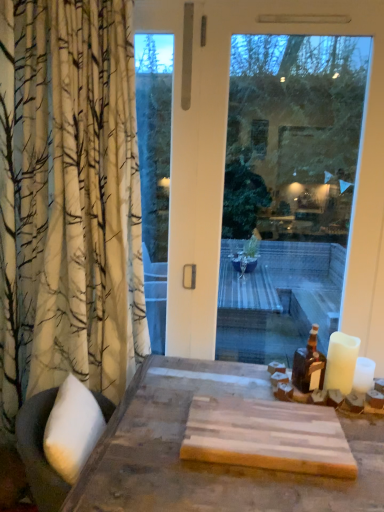
Question: Does point (311, 375) appear closer or farther from the camera than point (349, 356)?

Choices:
 (A) closer
 (B) farther

Answer: (B)

Question: From the image's perspective, is brown glass bottle at right located above or below white matte candle at right?

Choices:
 (A) below
 (B) above

Answer: (B)

Question: Which object is positioned farthest from the transparent glass window at center?

Choices:
 (A) white matte candle at right
 (B) brown glass bottle at right

Answer: (B)

Question: Estimate the real-world distances between objects in this image. Which object is closer to the brown glass bottle at right?

Choices:
 (A) transparent glass window at center
 (B) white matte candle at right

Answer: (B)